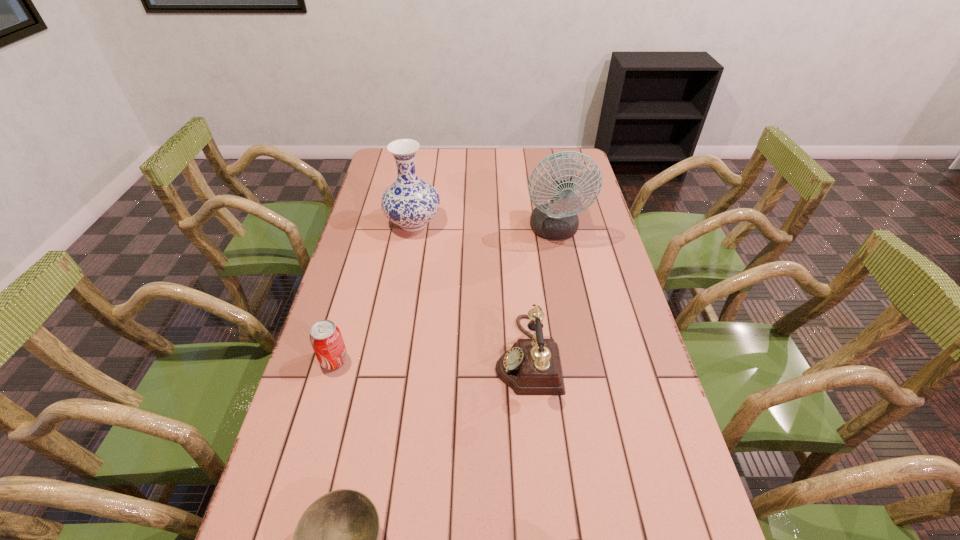
Identify the location of fan. The width and height of the screenshot is (960, 540). (557, 219).

This screenshot has width=960, height=540. Find the location of `vase`. vase is located at coordinates (410, 202).

Image resolution: width=960 pixels, height=540 pixels. I want to click on the fourth shortest object, so tap(531, 366).

Locate an element on the screen. soda is located at coordinates (325, 337).

Where is `free space located 0.150m in front of the fan where the airflow is directed`? The width and height of the screenshot is (960, 540). free space located 0.150m in front of the fan where the airflow is directed is located at coordinates point(564,282).

This screenshot has height=540, width=960. I want to click on free point located on the back of the vase, so click(x=420, y=190).

The image size is (960, 540). What are the coordinates of `free location located on the dial of the telephone` in the screenshot? It's located at (450, 355).

Locate an element on the screen. blank space located on the dial of the telephone is located at coordinates tap(417, 355).

The height and width of the screenshot is (540, 960). In order to click on free spot located 0.160m on the dial of the telephone in this screenshot , I will do `click(436, 355)`.

Where is `vacant region located on the right of the leftmost object`? Image resolution: width=960 pixels, height=540 pixels. vacant region located on the right of the leftmost object is located at coordinates (400, 360).